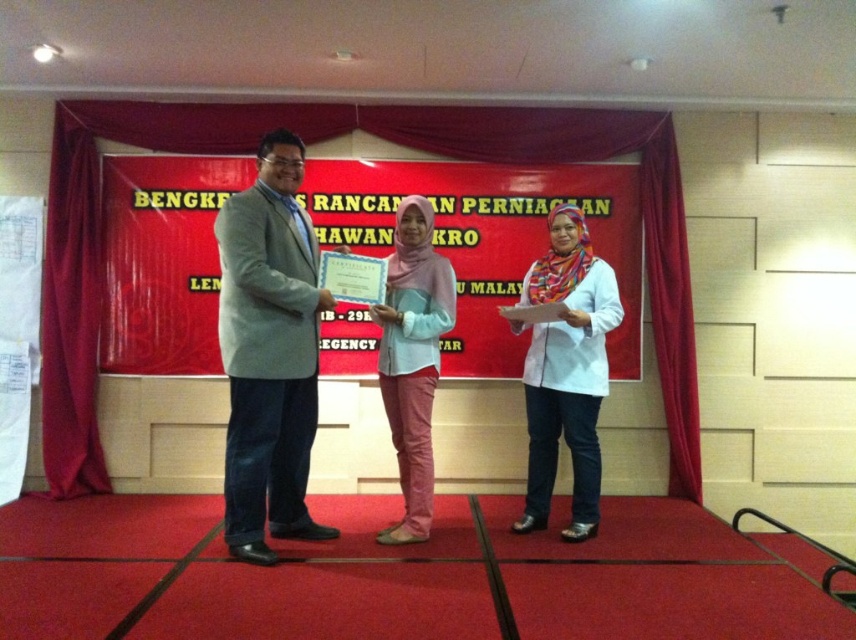
You are a photographer positioned at the back of the stage. You want to take a photo of the pink fabric hijab at center and the velvet red curtain at center. The camera you are using has a minimum focus distance of 1.5 meters. Can you focus on both objects clearly without moving closer?

The pink fabric hijab at center and the velvet red curtain at center are 1.69 meters apart. Since the minimum focus distance is 1.5 meters, the camera can focus on both objects clearly as the distance between them is greater than the minimum requirement.

You are an attendee at the event and want to take a photo of the white paper at center and the light gray suit at center. Which object should you focus on first if you want to capture both in one frame without moving the camera?

You should focus on the light gray suit at center first because the white paper at center is positioned to its right, so by centering the light gray suit at center, you can include both objects in the frame without moving the camera.